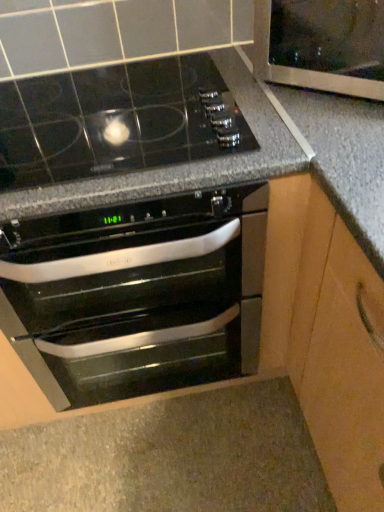
Question: In the image, is transparent glass door at upper right positioned in front of or behind black glass oven at center?

Choices:
 (A) front
 (B) behind

Answer: (B)

Question: In terms of width, does transparent glass door at upper right look wider or thinner when compared to black glass oven at center?

Choices:
 (A) wide
 (B) thin

Answer: (B)

Question: From a real-world perspective, is transparent glass door at upper right above or below black glass oven at center?

Choices:
 (A) above
 (B) below

Answer: (A)

Question: From a real-world perspective, relative to transparent glass door at upper right, is black glass oven at center vertically above or below?

Choices:
 (A) above
 (B) below

Answer: (B)

Question: Looking at their shapes, would you say black glass oven at center is wider or thinner than transparent glass door at upper right?

Choices:
 (A) wide
 (B) thin

Answer: (A)

Question: Is black glass oven at center to the left or to the right of transparent glass door at upper right in the image?

Choices:
 (A) left
 (B) right

Answer: (A)

Question: Considering the positions of black glass oven at center and transparent glass door at upper right in the image, is black glass oven at center taller or shorter than transparent glass door at upper right?

Choices:
 (A) tall
 (B) short

Answer: (A)